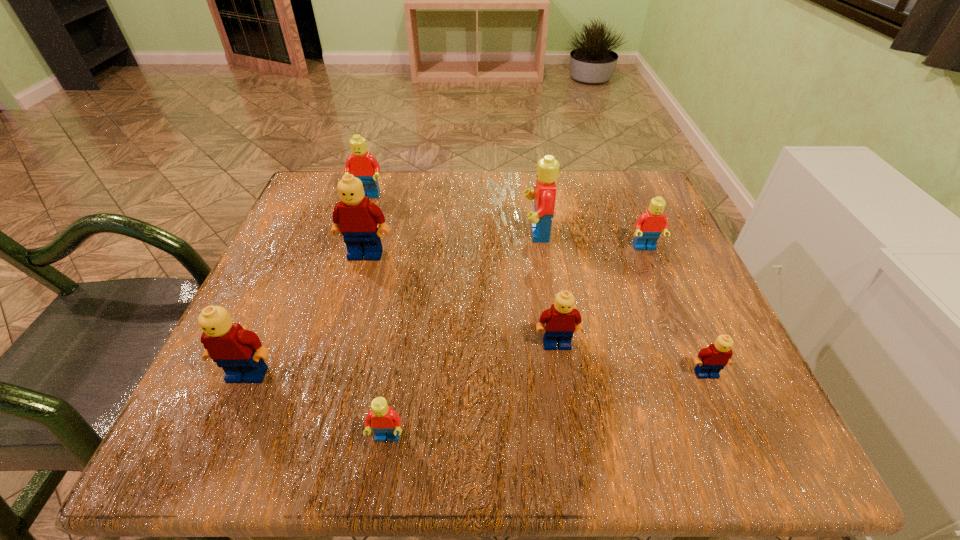
At what (x,y) coordinates should I click in order to perform the action: click on the second red Lego from right to left. Please return your answer as a coordinate pair (x, y). Looking at the image, I should click on click(544, 193).

You are a GUI agent. You are given a task and a screenshot of the screen. Output one action in this format:
    pyautogui.click(x=<x>, y=<y>)
    Task: Click on the biggest yellow Lego
    
    Given the screenshot: What is the action you would take?
    pyautogui.click(x=355, y=217)

The image size is (960, 540). I want to click on the farthest yellow Lego, so click(355, 217).

Locate an element on the screen. This screenshot has height=540, width=960. the third smallest red Lego is located at coordinates (361, 164).

Find the location of a particular element. The width and height of the screenshot is (960, 540). the farthest red Lego is located at coordinates (361, 164).

You are a GUI agent. You are given a task and a screenshot of the screen. Output one action in this format:
    pyautogui.click(x=<x>, y=<y>)
    Task: Click on the second biggest yellow Lego
    The height and width of the screenshot is (540, 960).
    Given the screenshot: What is the action you would take?
    pyautogui.click(x=238, y=351)

The height and width of the screenshot is (540, 960). In order to click on the leftmost Lego in this screenshot , I will do `click(238, 351)`.

This screenshot has height=540, width=960. Identify the location of the third biggest red Lego. (652, 222).

The width and height of the screenshot is (960, 540). I want to click on the third biggest yellow Lego, so click(562, 320).

Where is `the fifth farthest object`? the fifth farthest object is located at coordinates point(562,320).